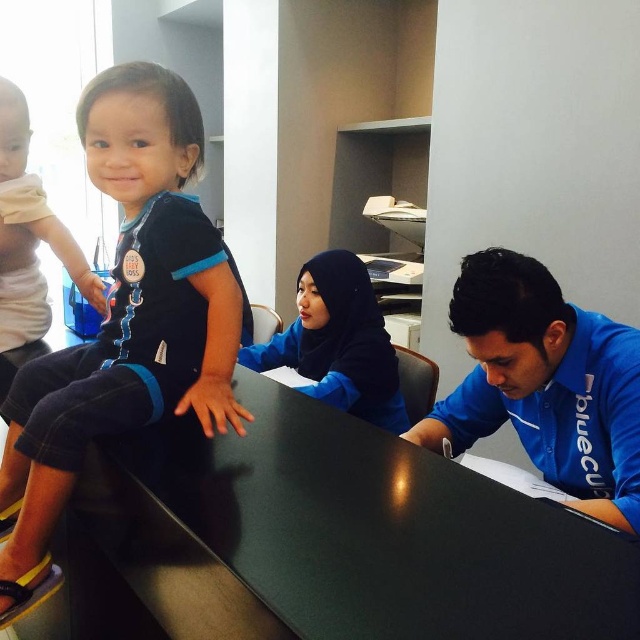
Who is taller, matte black shirt at upper left or blue cotton shirt at center?

With more height is matte black shirt at upper left.

You are a GUI agent. You are given a task and a screenshot of the screen. Output one action in this format:
    pyautogui.click(x=<x>, y=<y>)
    Task: Click on the matte black shirt at upper left
    This screenshot has height=640, width=640.
    Given the screenshot: What is the action you would take?
    pyautogui.click(x=125, y=321)

Locate an element on the screen. matte black shirt at upper left is located at coordinates (125, 321).

Can you confirm if blue cotton shirt at center is positioned below blue matte hijab at center?

Yes, blue cotton shirt at center is below blue matte hijab at center.

Who is more distant from viewer, (502, 260) or (360, 324)?

The point (360, 324) is more distant.

I want to click on blue cotton shirt at center, so click(545, 384).

Is point (468, 573) closer to camera compared to point (404, 417)?

That is True.

Is point (260, 572) positioned after point (349, 285)?

No, (260, 572) is closer to viewer.

Which is in front, point (216, 509) or point (259, 352)?

Point (216, 509)

Identify the location of black smooth table at center. (352, 532).